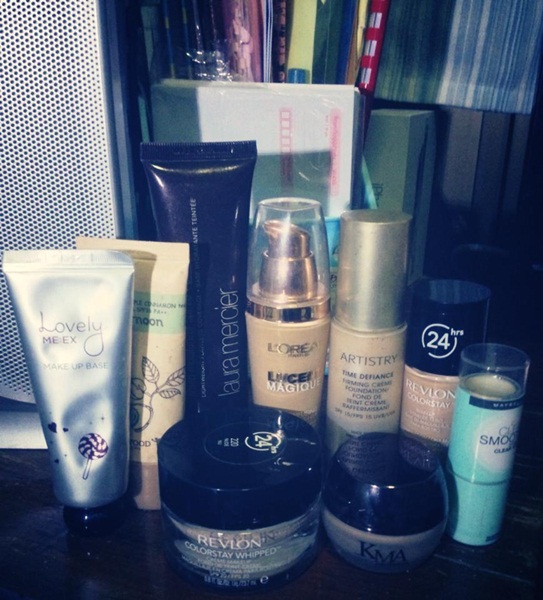
Find the location of a particular element. box is located at coordinates (255, 107).